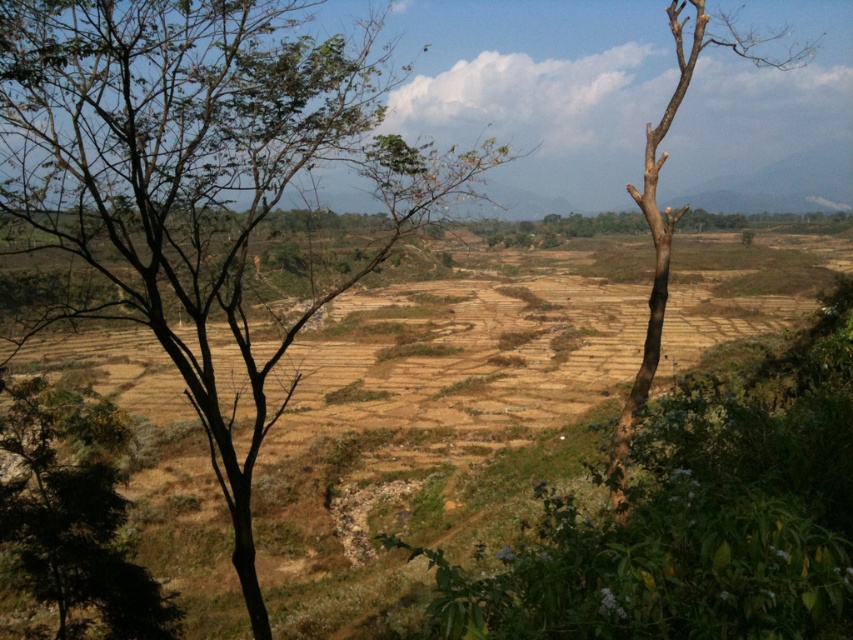
Question: Which object appears farthest from the camera in this image?

Choices:
 (A) bare wood tree at right
 (B) brown leafy tree at left

Answer: (B)

Question: Is brown leafy tree at left further to the viewer compared to bare wood tree at right?

Choices:
 (A) yes
 (B) no

Answer: (A)

Question: Which point is farther to the camera?

Choices:
 (A) brown leafy tree at left
 (B) bare wood tree at right

Answer: (A)

Question: Among these objects, which one is farthest from the camera?

Choices:
 (A) brown leafy tree at left
 (B) bare wood tree at right

Answer: (A)

Question: Does brown leafy tree at left have a smaller size compared to bare wood tree at right?

Choices:
 (A) yes
 (B) no

Answer: (A)

Question: Where is brown leafy tree at left located in relation to bare wood tree at right in the image?

Choices:
 (A) right
 (B) left

Answer: (B)